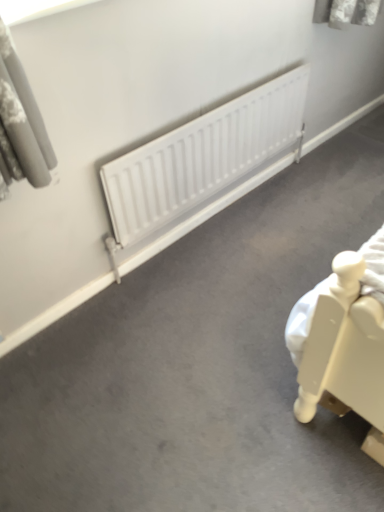
Where is `vacant point to the right of white matte radiator at center`? vacant point to the right of white matte radiator at center is located at coordinates (302, 204).